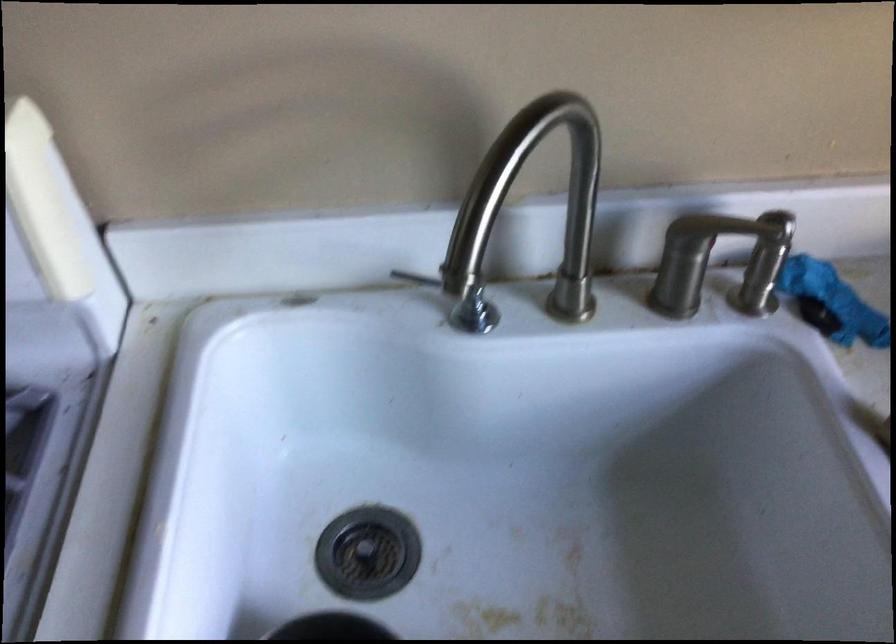
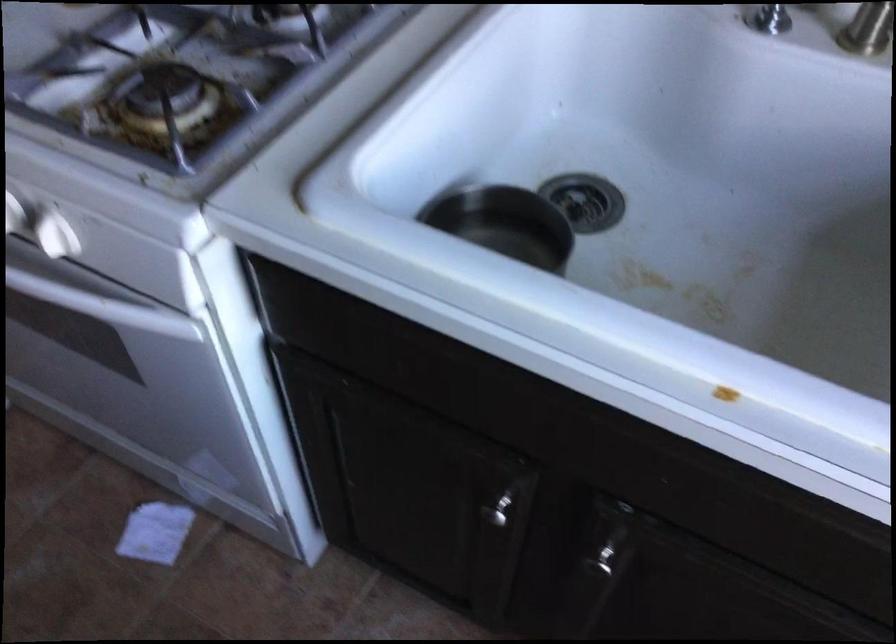
Question: I am providing you with two images of the same scene from different viewpoints. Which of the following objects are not visible in image2?

Choices:
 (A) white paper
 (B) white stove knob
 (C) metal bowl
 (D) none of these

Answer: (D)